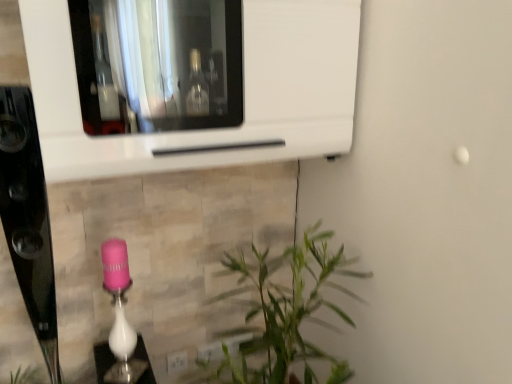
Question: From the image's perspective, relative to white glossy microwave at upper center, is white plastic electric outlet at lower center above or below?

Choices:
 (A) above
 (B) below

Answer: (B)

Question: Visually, is white plastic electric outlet at lower center positioned to the left or to the right of white glossy microwave at upper center?

Choices:
 (A) left
 (B) right

Answer: (A)

Question: Which is farther from the white glossy microwave at upper center?

Choices:
 (A) pink glossy lamp at lower center
 (B) white plastic electric outlet at lower center

Answer: (B)

Question: Which object is the closest to the white plastic electric outlet at lower center?

Choices:
 (A) pink glossy lamp at lower center
 (B) white glossy microwave at upper center

Answer: (A)